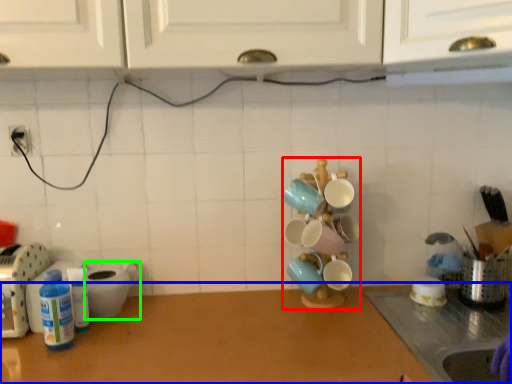
Question: Which object is positioned closest to tableware (highlighted by a red box)? Select from countertop (highlighted by a blue box) and appliance (highlighted by a green box).

Choices:
 (A) countertop
 (B) appliance

Answer: (A)